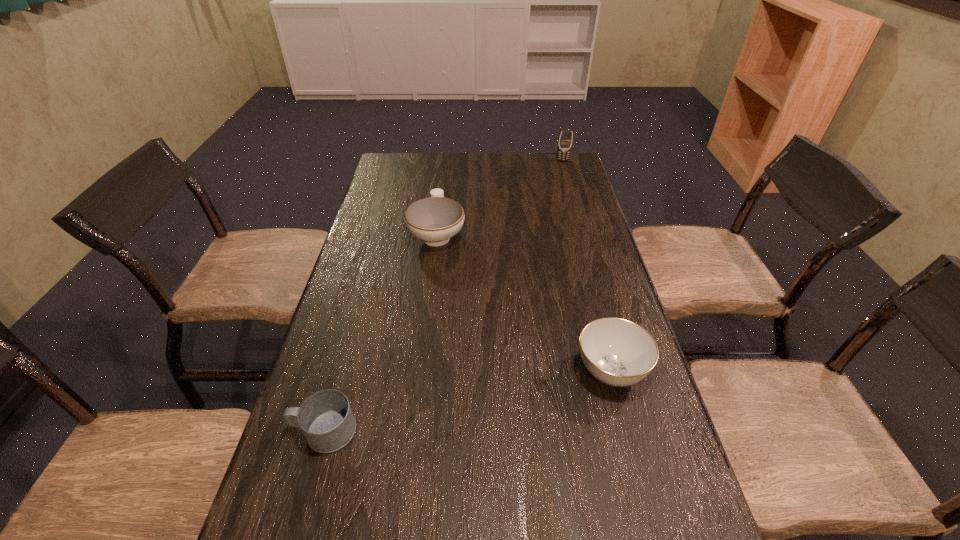
Locate an element on the screen. This screenshot has width=960, height=540. free space at the left edge of the desktop is located at coordinates (409, 234).

This screenshot has height=540, width=960. Find the location of `vacant space at the right edge of the desktop`. vacant space at the right edge of the desktop is located at coordinates (588, 220).

Identify the location of vacant space at the far left corner. Image resolution: width=960 pixels, height=540 pixels. (393, 154).

In the image, there is a desktop. Where is `free region at the far right corner`? free region at the far right corner is located at coordinates (548, 173).

Identify the location of unoccupied position between the shortest object and the farthest object. The image size is (960, 540). (444, 296).

Identify the location of free space between the shortest object and the right chinaware. (468, 401).

Image resolution: width=960 pixels, height=540 pixels. I want to click on unoccupied area between the nearer chinaware and the mug, so click(468, 401).

Image resolution: width=960 pixels, height=540 pixels. I want to click on vacant region between the farther chinaware and the cellular telephone, so click(x=500, y=197).

Identify the location of unoccupied position between the left chinaware and the tallest object. (500, 197).

Image resolution: width=960 pixels, height=540 pixels. What are the coordinates of `free spot between the left chinaware and the cellular telephone` in the screenshot? It's located at (500, 197).